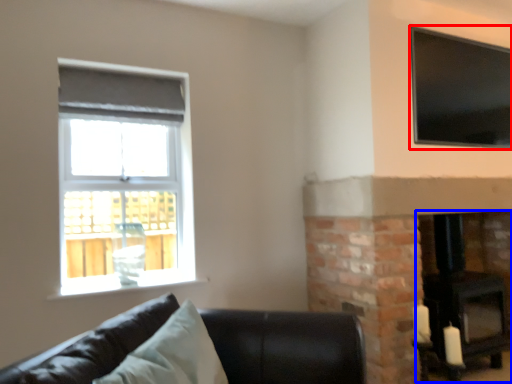
Question: Among these objects, which one is nearest to the camera, window (highlighted by a red box) or fireplace (highlighted by a blue box)?

Choices:
 (A) window
 (B) fireplace

Answer: (A)